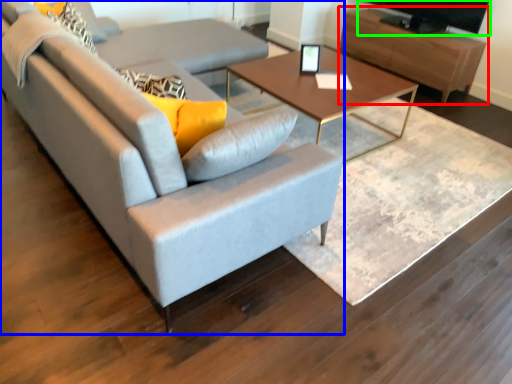
Question: Estimate the real-world distances between objects in this image. Which object is closer to entertainment center (highlighted by a red box), studio couch (highlighted by a blue box) or television (highlighted by a green box)?

Choices:
 (A) studio couch
 (B) television

Answer: (B)